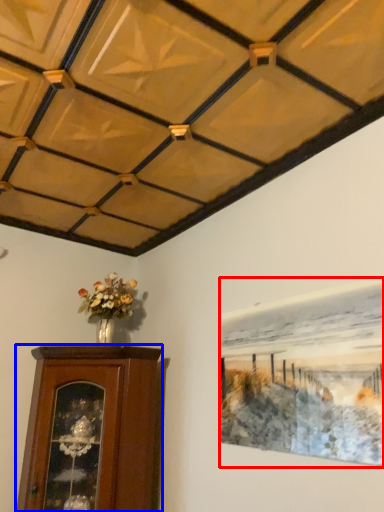
Question: Which point is closer to the camera, picture frame (highlighted by a red box) or furniture (highlighted by a blue box)?

Choices:
 (A) picture frame
 (B) furniture

Answer: (A)